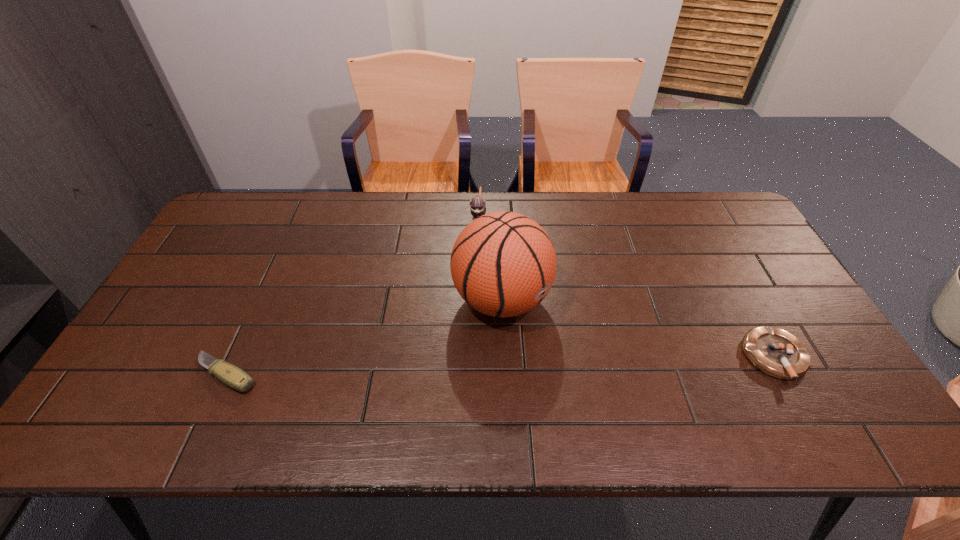
Find the location of a particular element. The width and height of the screenshot is (960, 540). vacant space located 0.270m on the front-facing side of the farthest object is located at coordinates (470, 292).

This screenshot has height=540, width=960. I want to click on free space located 0.160m on the front-facing side of the farthest object, so click(x=473, y=265).

The height and width of the screenshot is (540, 960). I want to click on vacant space situated on the side where the inflation valve is located, so click(x=568, y=349).

Image resolution: width=960 pixels, height=540 pixels. I want to click on blank space located on the side where the inflation valve is located, so click(565, 347).

This screenshot has height=540, width=960. Identify the location of vacant space located on the side where the inflation valve is located. (557, 340).

The height and width of the screenshot is (540, 960). In order to click on object that is at the far edge in this screenshot , I will do `click(478, 208)`.

Locate an element on the screen. The height and width of the screenshot is (540, 960). pocketknife that is at the near edge is located at coordinates (232, 376).

Locate an element on the screen. The image size is (960, 540). ashtray that is at the near edge is located at coordinates (777, 353).

Where is `object positioned at the right edge`? object positioned at the right edge is located at coordinates (777, 353).

Image resolution: width=960 pixels, height=540 pixels. Find the location of `object that is at the near right corner`. object that is at the near right corner is located at coordinates (777, 353).